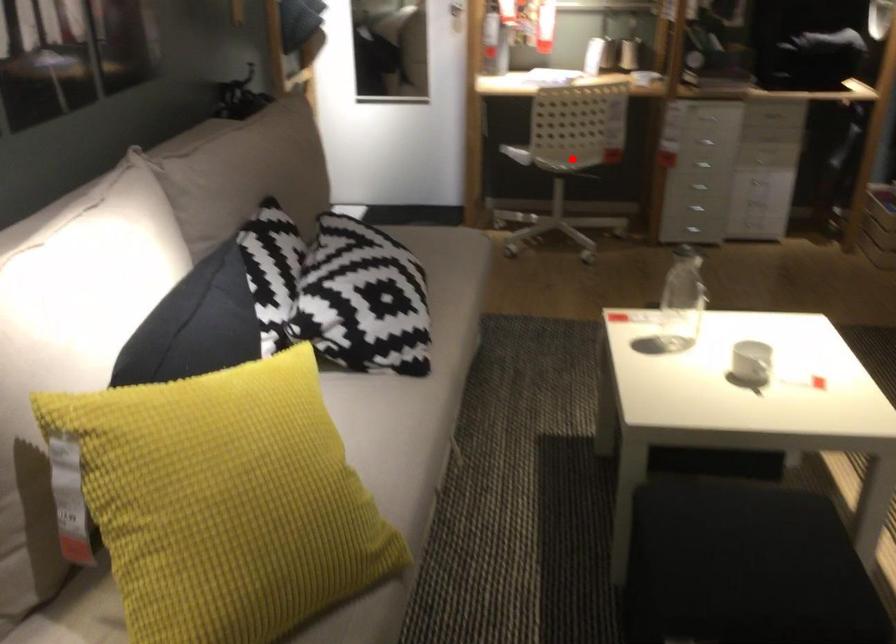
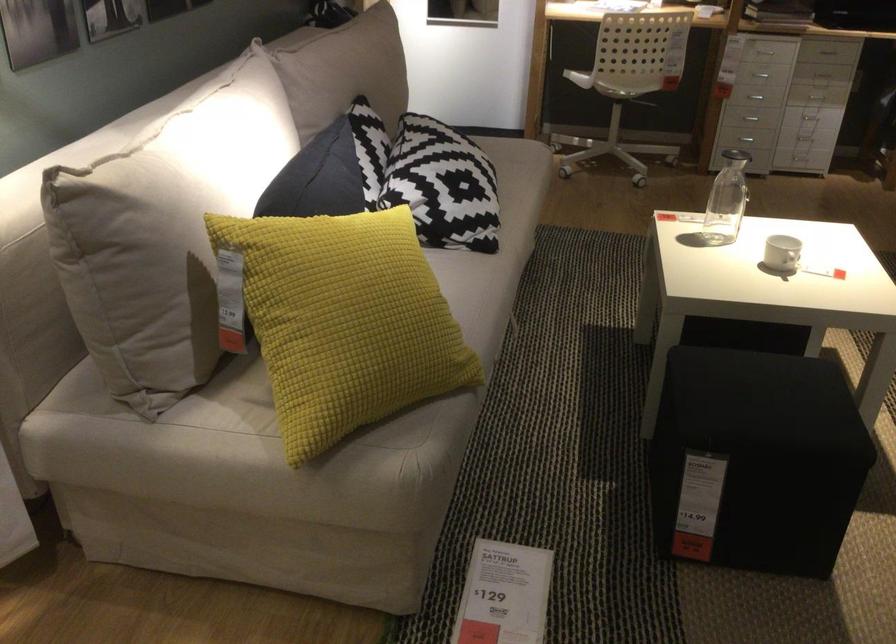
In the second image, find the point that corresponds to the highlighted location in the first image.

(627, 80)